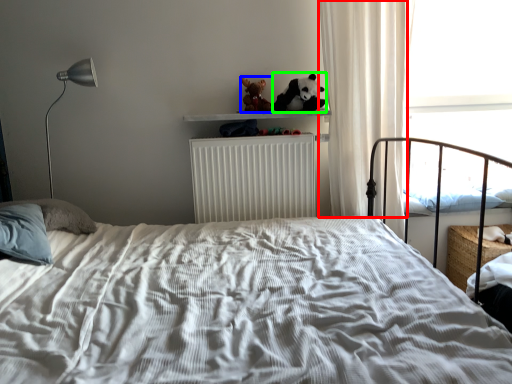
Question: Which object is positioned farthest from curtain (highlighted by a red box)? Select from figurine (highlighted by a blue box) and panda (highlighted by a green box).

Choices:
 (A) figurine
 (B) panda

Answer: (A)